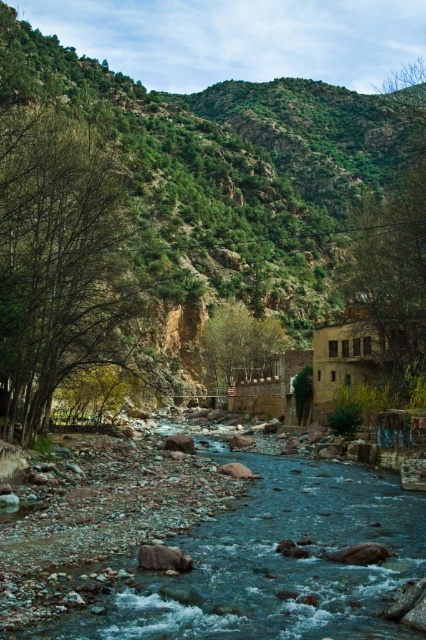
Question: Considering the real-world distances, which object is farthest from the green rocky mountain at center?

Choices:
 (A) green leafy tree at center
 (B) smooth rock stream at center
 (C) green leafy tree at left

Answer: (B)

Question: Considering the real-world distances, which object is farthest from the smooth rock stream at center?

Choices:
 (A) green rocky mountain at center
 (B) green leafy tree at left

Answer: (A)

Question: Observing the image, what is the correct spatial positioning of smooth rock stream at center in reference to green leafy tree at center?

Choices:
 (A) left
 (B) right

Answer: (A)

Question: Observing the image, what is the correct spatial positioning of green rocky mountain at center in reference to green leafy tree at left?

Choices:
 (A) left
 (B) right

Answer: (B)

Question: Is green rocky mountain at center closer to the viewer compared to green leafy tree at center?

Choices:
 (A) yes
 (B) no

Answer: (A)

Question: Which point is farther from the camera taking this photo?

Choices:
 (A) (242, 321)
 (B) (321, 305)
 (C) (74, 273)

Answer: (B)